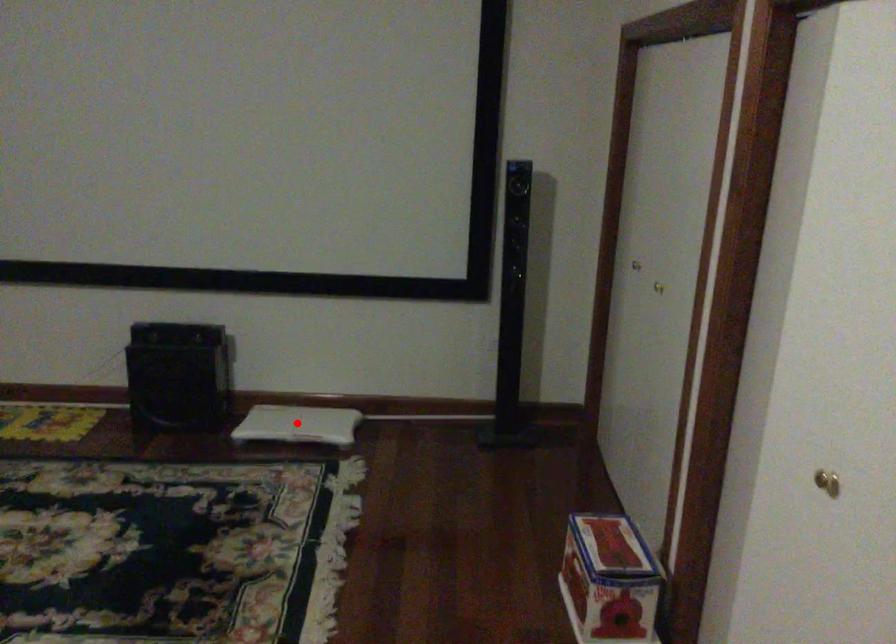
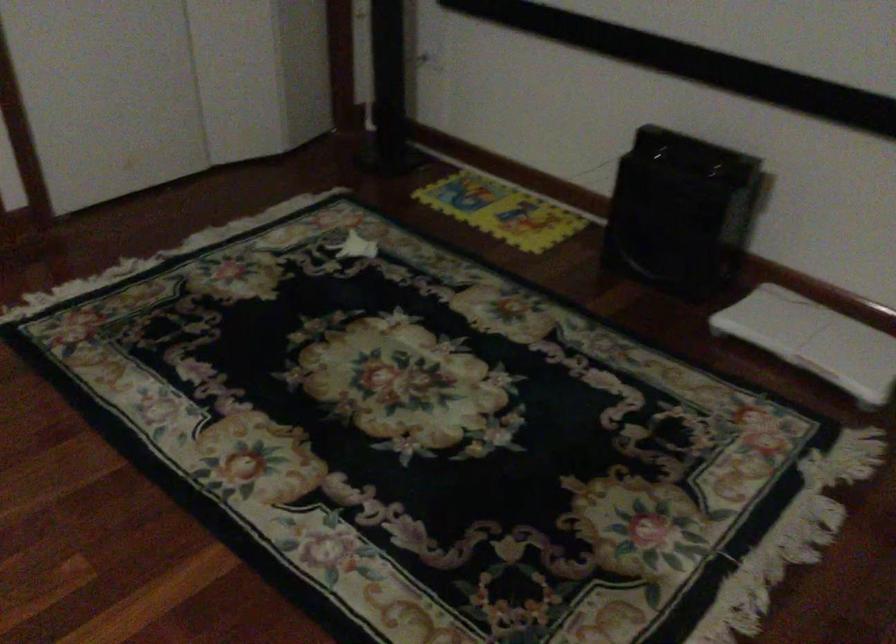
In the second image, find the point that corresponds to the highlighted location in the first image.

(814, 339)